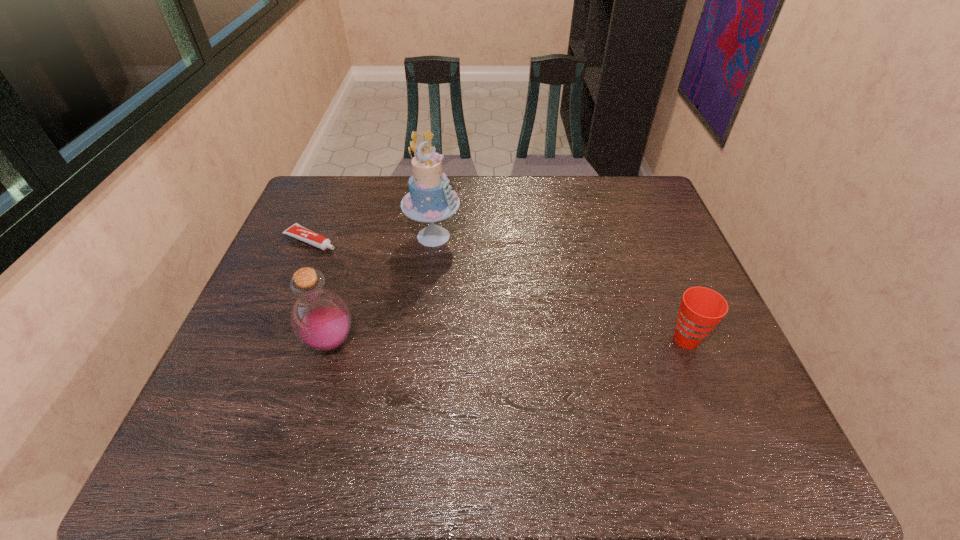
Find the location of `free space at the far right corner of the desktop`. free space at the far right corner of the desktop is located at coordinates (659, 217).

At what (x,y) coordinates should I click in order to perform the action: click on empty space that is in between the cup and the bottle. Please return your answer as a coordinate pair (x, y). This screenshot has height=540, width=960. Looking at the image, I should click on (508, 341).

I want to click on vacant area that lies between the rightmost object and the second tallest object, so [x=508, y=341].

Where is `vacant region between the third shortest object and the rightmost object`? vacant region between the third shortest object and the rightmost object is located at coordinates (508, 341).

Locate an element on the screen. The image size is (960, 540). empty location between the third object from left to right and the bottle is located at coordinates (382, 289).

Where is `free space between the third tallest object and the second tallest object`? The width and height of the screenshot is (960, 540). free space between the third tallest object and the second tallest object is located at coordinates pos(508,341).

Find the location of `vacant point located between the second object from right to left and the third tallest object`. vacant point located between the second object from right to left and the third tallest object is located at coordinates (560, 288).

Locate an element on the screen. This screenshot has width=960, height=540. object that ranks as the second closest to the second shortest object is located at coordinates (320, 318).

Identify which object is the closest to the toothpaste. Please provide its 2D coordinates. Your answer should be formatted as a tuple, i.e. [(x, y)], where the tuple contains the x and y coordinates of a point satisfying the conditions above.

[(430, 199)]

The width and height of the screenshot is (960, 540). In order to click on vacant point that satisfies the following two spatial constraints: 1. on the front side of the cup; 2. on the right side of the shortest object in this screenshot , I will do `click(270, 340)`.